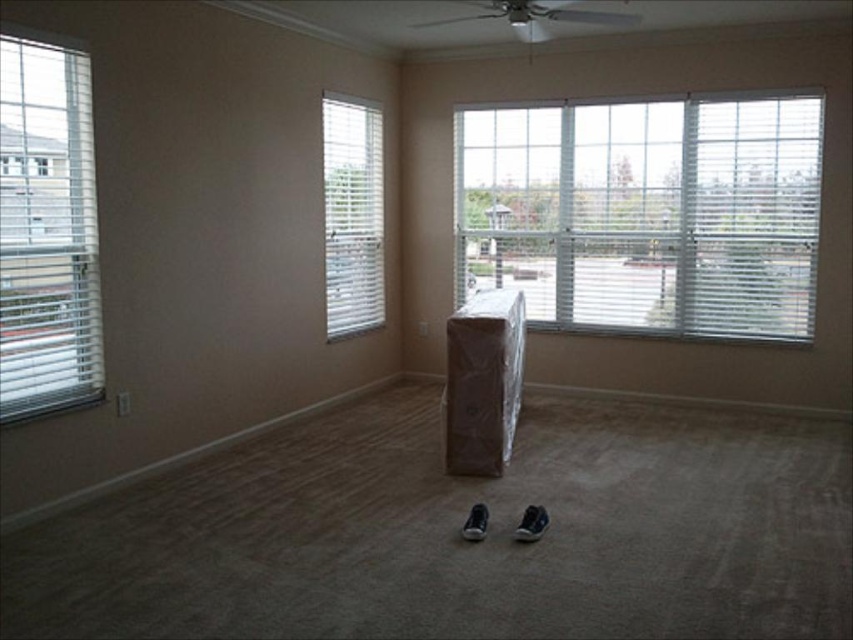
Which is behind, point (64, 292) or point (477, 515)?

The point (64, 292) is behind.

Which of these two, white blinds at left or black suede shoe at center, stands shorter?

Standing shorter between the two is black suede shoe at center.

Does point (83, 132) come in front of point (480, 516)?

No, (83, 132) is further to viewer.

Identify the location of white blinds at left. The width and height of the screenshot is (853, 640). (45, 230).

Who is more distant from viewer, (778, 140) or (4, 241)?

The point (778, 140) is behind.

Between white textured blinds at upper right and white blinds at left, which one appears on the right side from the viewer's perspective?

Positioned to the right is white textured blinds at upper right.

Which is in front, point (692, 209) or point (74, 147)?

Point (74, 147) is more forward.

At what (x,y) coordinates should I click in order to perform the action: click on white textured blinds at upper right. Please return your answer as a coordinate pair (x, y). The height and width of the screenshot is (640, 853). Looking at the image, I should click on (645, 212).

Who is positioned more to the right, white blinds at center or black leather shoe at lower center?

black leather shoe at lower center is more to the right.

Does point (338, 97) lie in front of point (526, 528)?

No, (338, 97) is behind (526, 528).

Locate an element on the screen. This screenshot has height=640, width=853. white blinds at center is located at coordinates (352, 214).